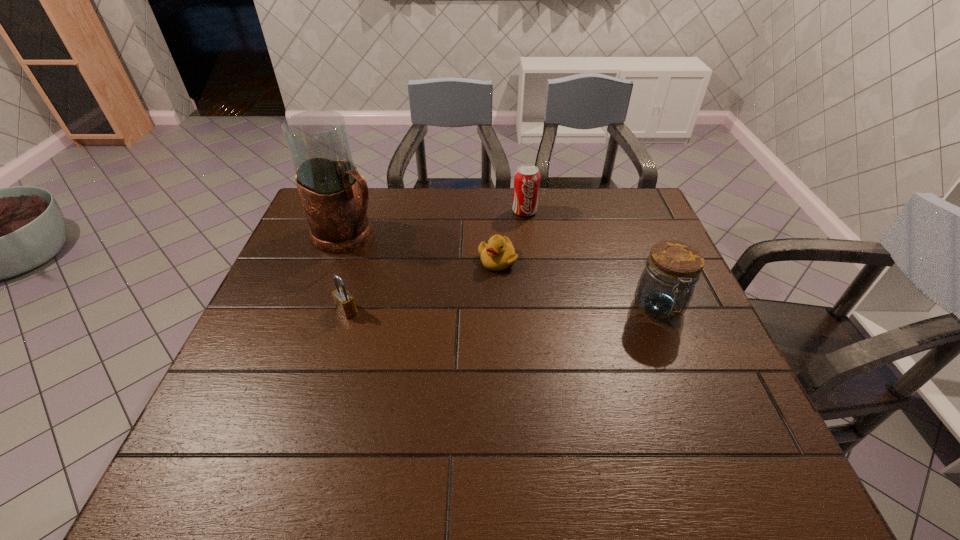
Locate an element on the screen. The image size is (960, 540). object that is the second nearest to the rightmost object is located at coordinates (527, 177).

This screenshot has height=540, width=960. I want to click on vacant space that satisfies the following two spatial constraints: 1. on the front side of the tallest object; 2. on the right side of the padlock, so click(321, 310).